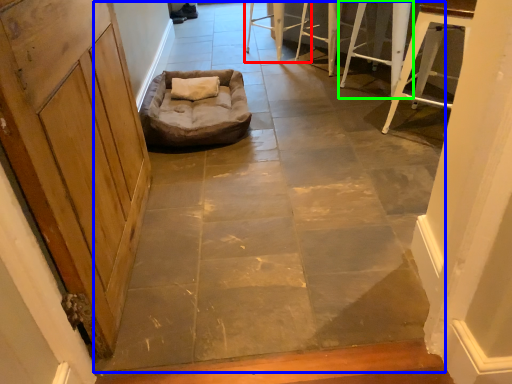
Question: Based on their relative distances, which object is nearer to furniture (highlighted by a red box)? Choose from concrete (highlighted by a blue box) and furniture (highlighted by a green box).

Choices:
 (A) concrete
 (B) furniture

Answer: (B)